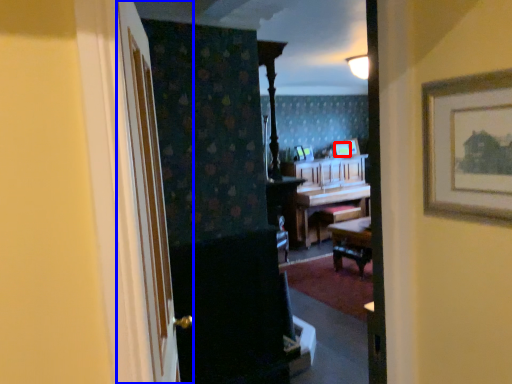
Question: Among these objects, which one is farthest to the camera, picture frame (highlighted by a red box) or door (highlighted by a blue box)?

Choices:
 (A) picture frame
 (B) door

Answer: (A)